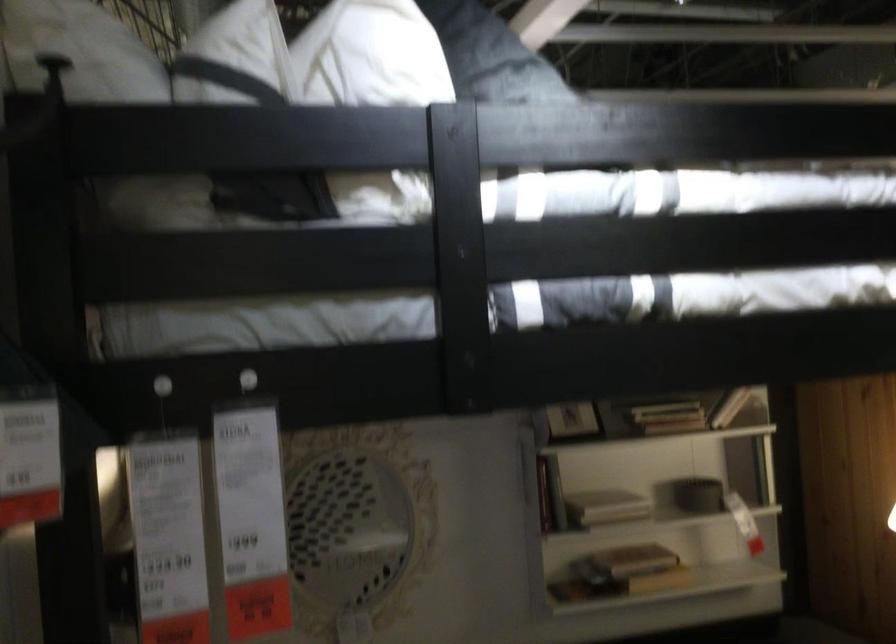
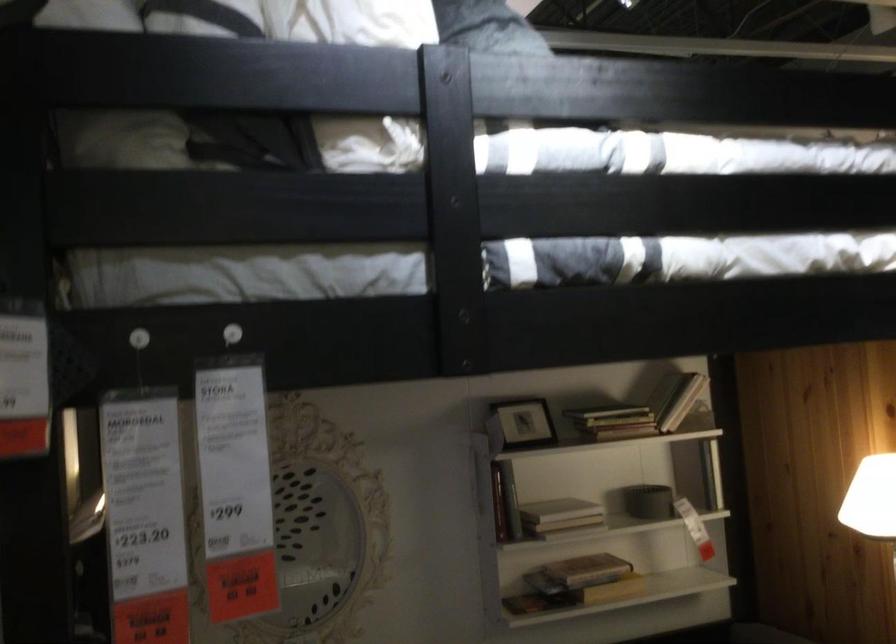
In the second image, find the point that corresponds to pixel 700 497 in the first image.

(648, 502)